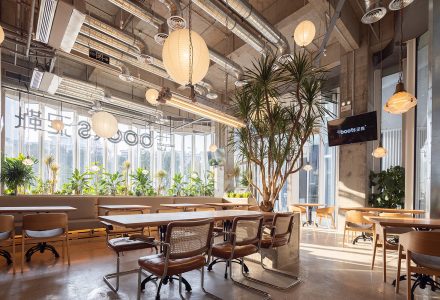
I want to click on tables in restaurant, so click(x=45, y=208), click(x=124, y=206), click(x=180, y=206), click(x=228, y=202), click(x=208, y=214), click(x=395, y=220), click(x=368, y=205), click(x=312, y=204).